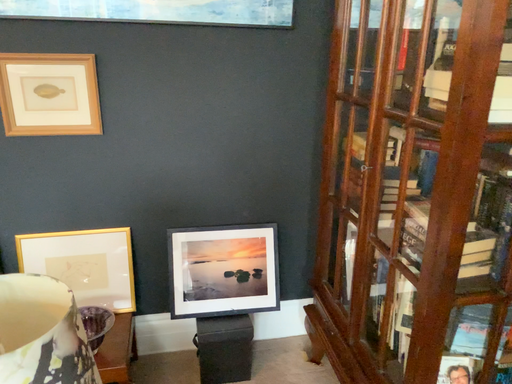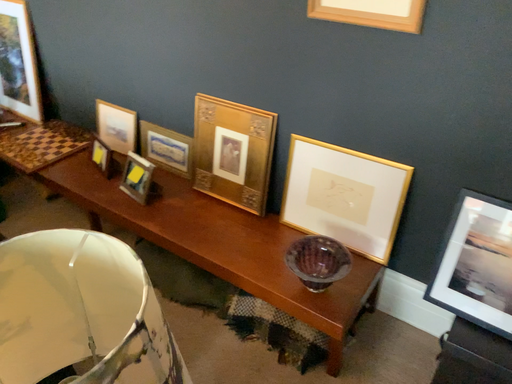
Question: Which way did the camera rotate in the video?

Choices:
 (A) rotated upward
 (B) rotated downward

Answer: (B)